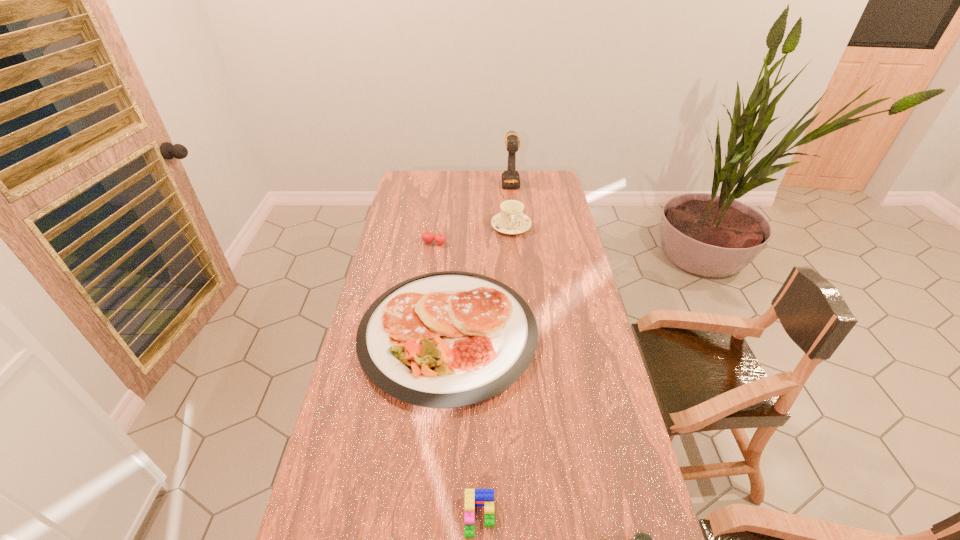
At what (x,y) coordinates should I click in order to perform the action: click on free space between the dish and the tallest object. Please return your answer as a coordinate pair (x, y). The height and width of the screenshot is (540, 960). Looking at the image, I should click on (479, 257).

In order to click on object that is the second closest to the third nearest object in this screenshot , I will do `click(473, 497)`.

Point out which object is positioned as the fifth nearest to the Lego. Please provide its 2D coordinates. Your answer should be formatted as a tuple, i.e. [(x, y)], where the tuple contains the x and y coordinates of a point satisfying the conditions above.

[(510, 177)]